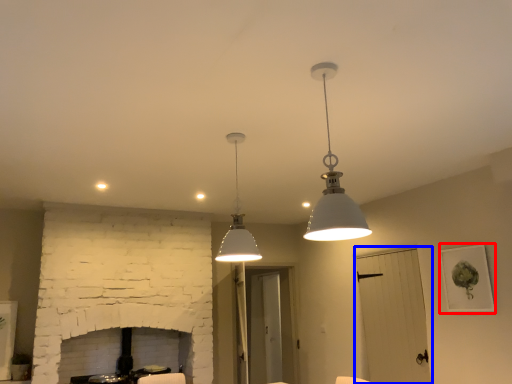
Question: Which object is closer to the camera taking this photo, picture frame (highlighted by a red box) or glass door (highlighted by a blue box)?

Choices:
 (A) picture frame
 (B) glass door

Answer: (A)